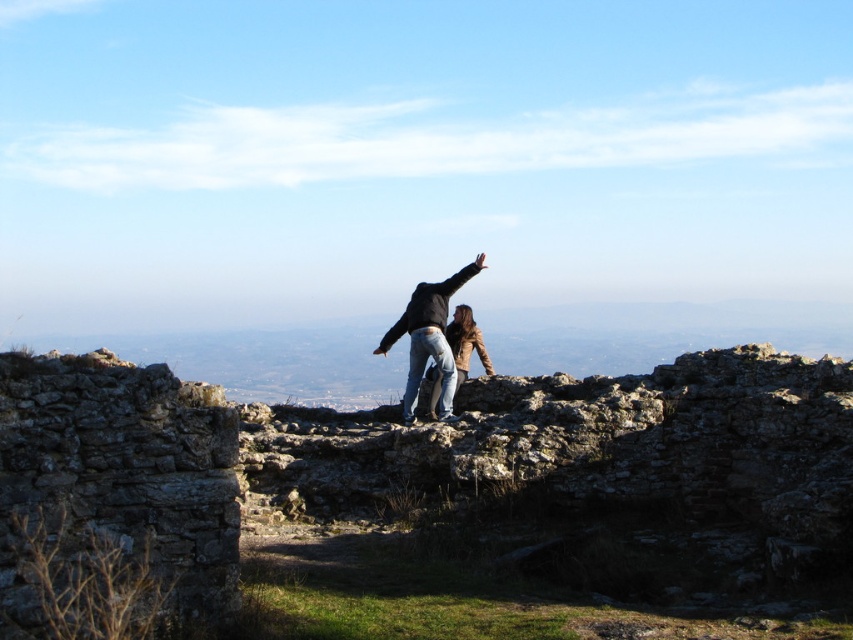
Question: Is jeans at center positioned before leather jacket at center?

Choices:
 (A) yes
 (B) no

Answer: (A)

Question: Which point is farther to the camera?

Choices:
 (A) (463, 376)
 (B) (363, 513)
 (C) (403, 420)

Answer: (A)

Question: Among these objects, which one is farthest from the camera?

Choices:
 (A) rustic stone ruins at center
 (B) leather jacket at center
 (C) jeans at center

Answer: (B)

Question: In this image, where is rustic stone ruins at center located relative to jeans at center?

Choices:
 (A) above
 (B) below

Answer: (B)

Question: Which object is farther from the camera taking this photo?

Choices:
 (A) jeans at center
 (B) leather jacket at center

Answer: (B)

Question: Does rustic stone ruins at center have a greater width compared to leather jacket at center?

Choices:
 (A) no
 (B) yes

Answer: (B)